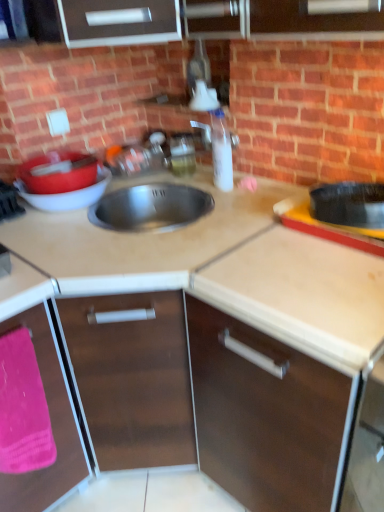
Where is `free location above beige laminate countertop at center, arranged as the second countertop when viewed from the top (from a real-world perspective)`? free location above beige laminate countertop at center, arranged as the second countertop when viewed from the top (from a real-world perspective) is located at coordinates (187, 239).